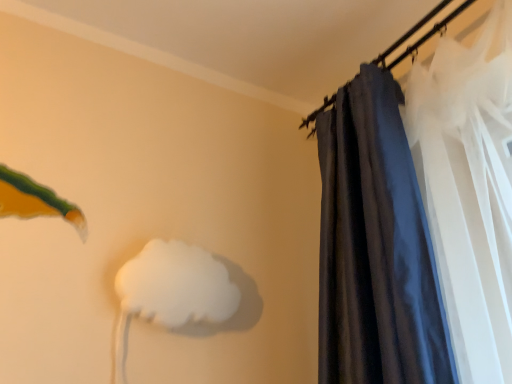
In order to click on white matte cloud at center in this screenshot , I will do `click(175, 286)`.

Describe the element at coordinates (175, 286) in the screenshot. I see `white matte cloud at center` at that location.

Where is `white matte cloud at center`? The width and height of the screenshot is (512, 384). white matte cloud at center is located at coordinates (175, 286).